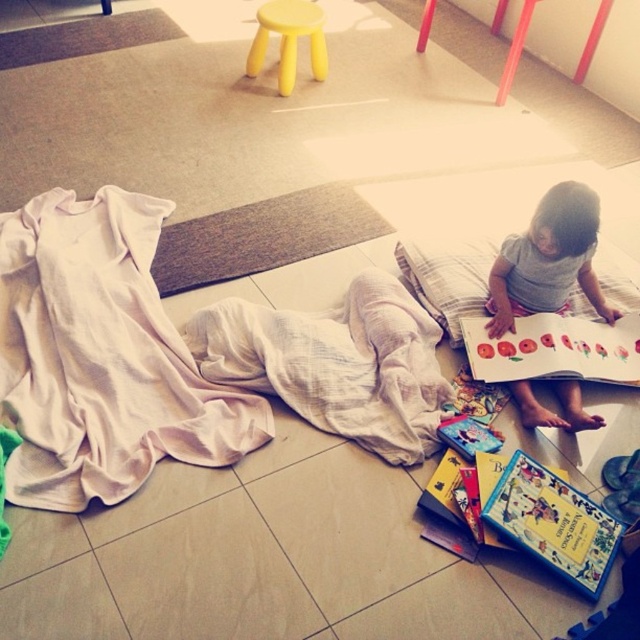
Question: Is gray cotton toddler at center further to the viewer compared to matte paper book at center?

Choices:
 (A) yes
 (B) no

Answer: (B)

Question: Which is nearer to the yellow plastic stool at upper center?

Choices:
 (A) matte paper book at center
 (B) gray cotton toddler at center
 (C) white cotton blanket at lower left
 (D) hardcover book at lower right

Answer: (C)

Question: Which point appears farthest from the camera in this image?

Choices:
 (A) (513, 266)
 (B) (246, 401)

Answer: (A)

Question: Does white cotton blanket at lower left come in front of gray cotton toddler at center?

Choices:
 (A) no
 (B) yes

Answer: (B)

Question: Does white cotton blanket at lower left appear on the right side of yellow plastic stool at upper center?

Choices:
 (A) no
 (B) yes

Answer: (A)

Question: Which object appears farthest from the camera in this image?

Choices:
 (A) matte paper book at center
 (B) yellow plastic stool at upper center
 (C) white cotton blanket at lower left

Answer: (B)